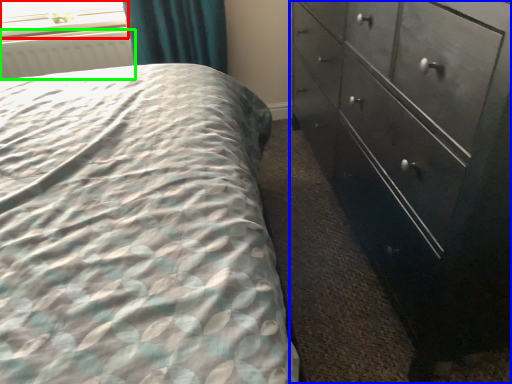
Question: Estimate the real-world distances between objects in this image. Which object is closer to window screen (highlighted by a red box), chest of drawers (highlighted by a blue box) or radiator (highlighted by a green box)?

Choices:
 (A) chest of drawers
 (B) radiator

Answer: (B)